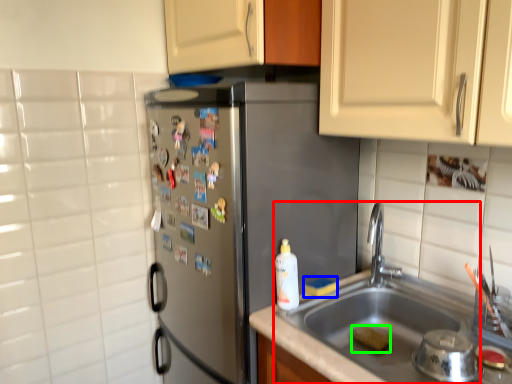
Question: Based on their relative distances, which object is farther from sink (highlighted by a red box)? Choose from food (highlighted by a blue box) and food (highlighted by a green box).

Choices:
 (A) food
 (B) food

Answer: (A)